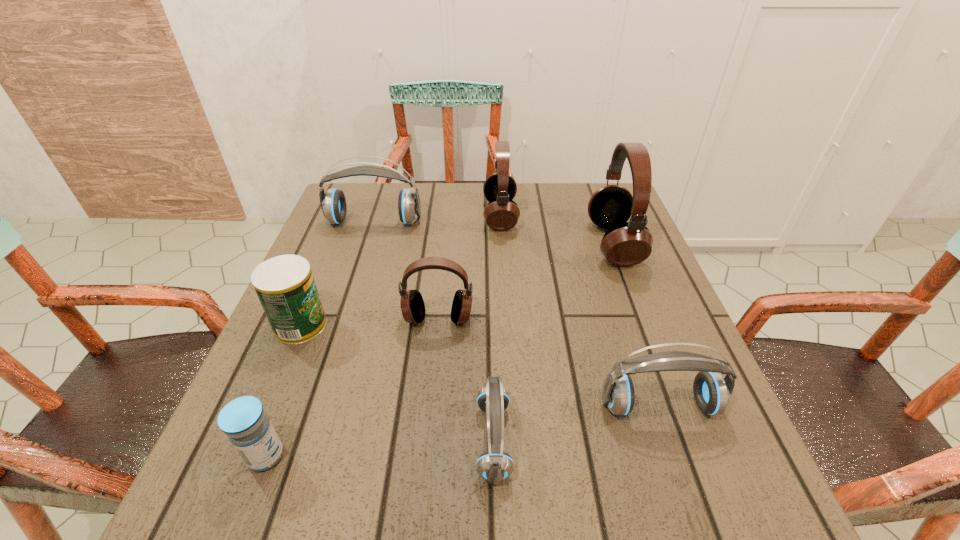
This screenshot has width=960, height=540. I want to click on medicine that is at the left edge, so click(x=243, y=420).

You are a GUI agent. You are given a task and a screenshot of the screen. Output one action in this format:
    pyautogui.click(x=<x>, y=<y>)
    Task: Click on the object positioned at the far left corner
    This screenshot has height=540, width=960.
    Given the screenshot: What is the action you would take?
    pyautogui.click(x=333, y=203)

Where is `object present at the near left corner`? The width and height of the screenshot is (960, 540). object present at the near left corner is located at coordinates coord(243,420).

At what (x,y) coordinates should I click in order to perform the action: click on object positioned at the far right corner. Please return your answer as a coordinate pair (x, y). Looking at the image, I should click on (625, 244).

Image resolution: width=960 pixels, height=540 pixels. In the image, there is a desktop. What are the coordinates of `free space at the far edge` in the screenshot? It's located at click(x=518, y=205).

Image resolution: width=960 pixels, height=540 pixels. Find the location of `vacant point at the near edge`. vacant point at the near edge is located at coordinates (556, 491).

Where is `free space at the left edge`? This screenshot has height=540, width=960. free space at the left edge is located at coordinates (264, 348).

In order to click on vacant area at the right edge in this screenshot , I will do `click(661, 453)`.

In order to click on free space at the far left corner of the desktop in this screenshot , I will do `click(372, 207)`.

Where is `vacant space at the near left corner`? This screenshot has width=960, height=540. vacant space at the near left corner is located at coordinates (242, 507).